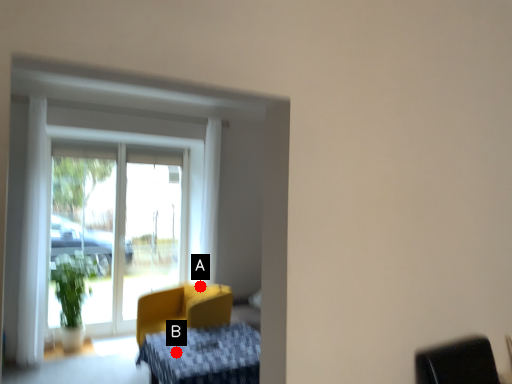
Question: Two points are circled on the image, labeled by A and B beside each circle. Which point is further to the camera?

Choices:
 (A) A is further
 (B) B is further

Answer: (A)